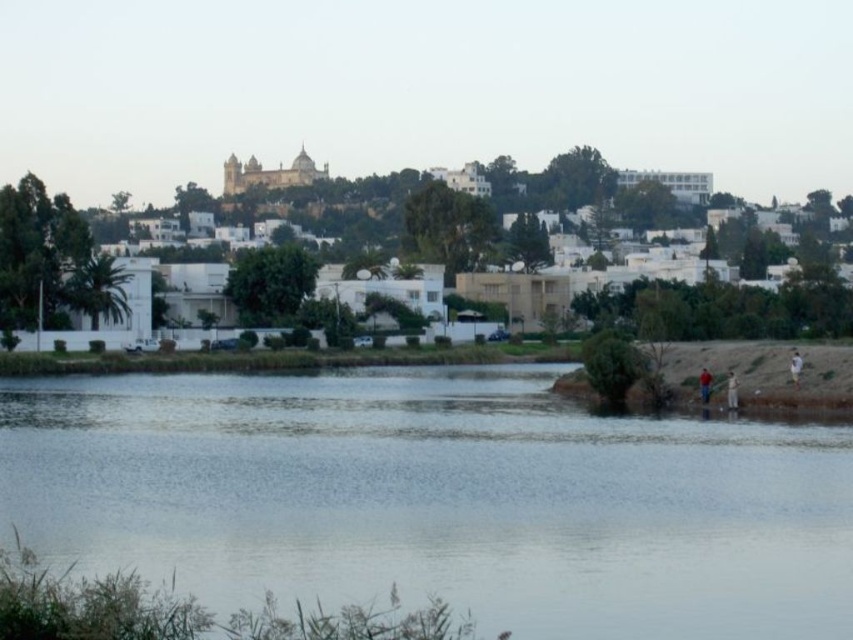
Who is more distant from viewer, (728, 371) or (791, 353)?

The point (791, 353) is behind.

Locate an element on the screen. This screenshot has width=853, height=640. light brown wooden stick at lower right is located at coordinates (730, 390).

Is clear water at lower center further to camera compared to white cotton shirt at lower right?

No, clear water at lower center is in front of white cotton shirt at lower right.

Is clear water at lower center taller than white cotton shirt at lower right?

Indeed, clear water at lower center has a greater height compared to white cotton shirt at lower right.

Is point (633, 536) closer to viewer compared to point (798, 365)?

Yes, it is.

Locate an element on the screen. The image size is (853, 640). clear water at lower center is located at coordinates pyautogui.click(x=437, y=499).

Is light brown wooden stick at lower right smaller than brown leather jacket at lower right?

Indeed, light brown wooden stick at lower right has a smaller size compared to brown leather jacket at lower right.

Does light brown wooden stick at lower right appear on the right side of brown leather jacket at lower right?

Indeed, light brown wooden stick at lower right is positioned on the right side of brown leather jacket at lower right.

What do you see at coordinates (730, 390) in the screenshot? The image size is (853, 640). I see `light brown wooden stick at lower right` at bounding box center [730, 390].

Where is `light brown wooden stick at lower right`? The height and width of the screenshot is (640, 853). light brown wooden stick at lower right is located at coordinates (730, 390).